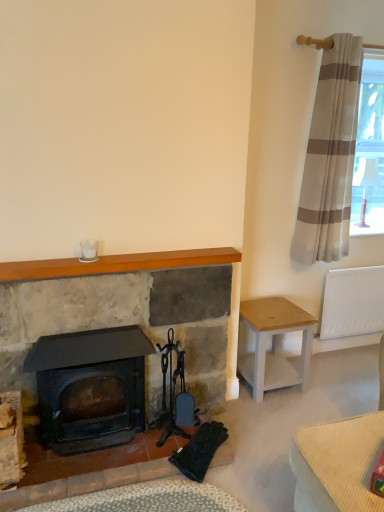
I want to click on vacant region below matte black wood burning stove at center-left (from a real-world perspective), so click(100, 446).